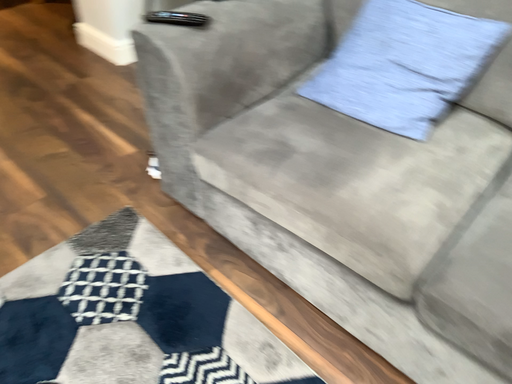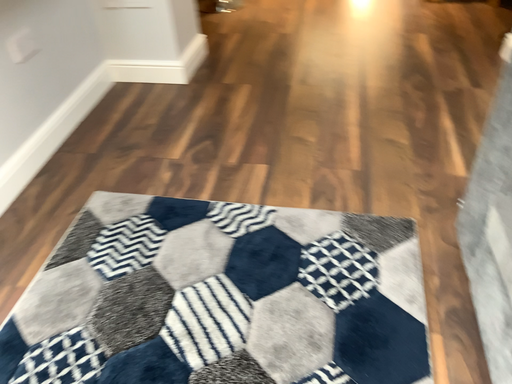
Question: Which way did the camera rotate in the video?

Choices:
 (A) rotated left
 (B) rotated right

Answer: (A)